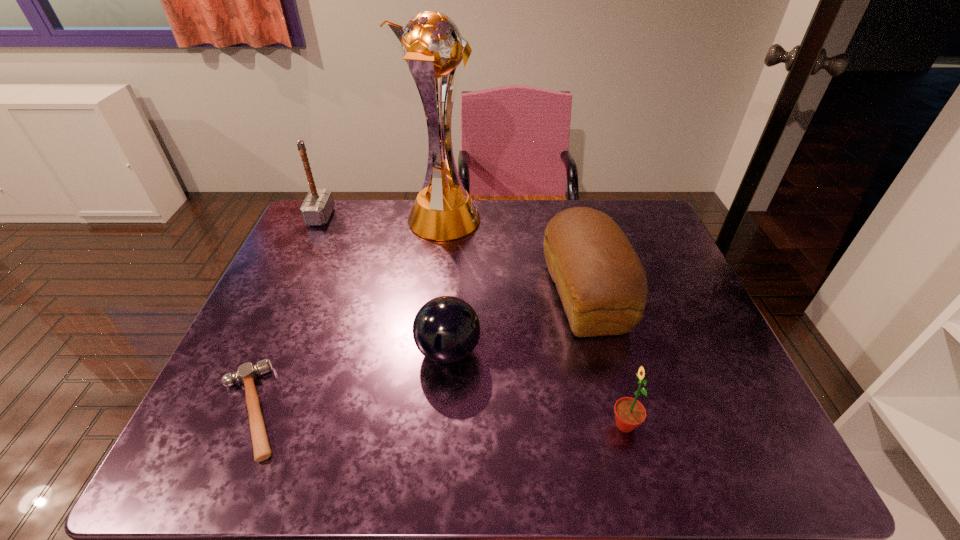
Locate an element on the screen. This screenshot has width=960, height=540. object that is positioned at the far left corner is located at coordinates [x=318, y=205].

Find the location of `object that is at the near left corner`. object that is at the near left corner is located at coordinates (247, 373).

I want to click on vacant space at the far edge, so click(x=582, y=205).

The width and height of the screenshot is (960, 540). I want to click on vacant region at the near edge of the desktop, so click(x=419, y=442).

This screenshot has width=960, height=540. In the image, there is a desktop. Find the location of `vacant space at the right edge`. vacant space at the right edge is located at coordinates coord(694,362).

At what (x,y) coordinates should I click in order to perform the action: click on free space at the far left corner. Please return your answer as a coordinate pair (x, y). The height and width of the screenshot is (540, 960). Looking at the image, I should click on (319, 242).

I want to click on vacant space at the near left corner of the desktop, so click(x=226, y=468).

Where is `vacant space in between the farther hammer and the shorter hammer`? The width and height of the screenshot is (960, 540). vacant space in between the farther hammer and the shorter hammer is located at coordinates (286, 313).

Where is `free space between the nearer hammer and the bread`? This screenshot has width=960, height=540. free space between the nearer hammer and the bread is located at coordinates pyautogui.click(x=419, y=353).

The width and height of the screenshot is (960, 540). Find the location of `free spot between the farther hammer and the shortest object`. free spot between the farther hammer and the shortest object is located at coordinates (286, 313).